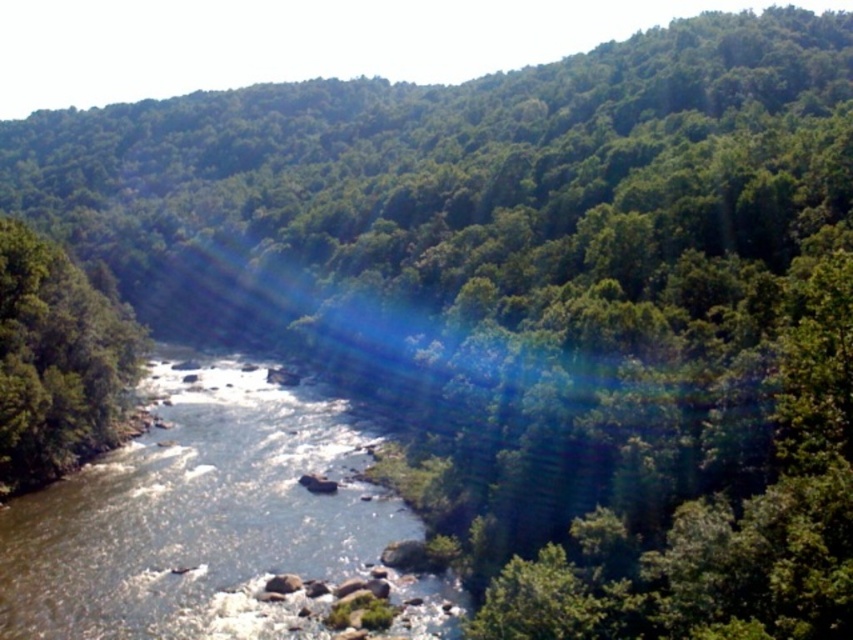
Question: Which of the following is the closest to the observer?

Choices:
 (A) green leafy tree at left
 (B) clear water at center

Answer: (B)

Question: Can you confirm if clear water at center is positioned to the left of green leafy tree at left?

Choices:
 (A) no
 (B) yes

Answer: (A)

Question: Which point is closer to the camera?

Choices:
 (A) (292, 531)
 (B) (57, 317)

Answer: (A)

Question: Which point is farther from the camera taking this photo?

Choices:
 (A) (13, 404)
 (B) (340, 484)

Answer: (B)

Question: Is clear water at center thinner than green leafy tree at left?

Choices:
 (A) yes
 (B) no

Answer: (B)

Question: Is clear water at center to the right of green leafy tree at left from the viewer's perspective?

Choices:
 (A) no
 (B) yes

Answer: (B)